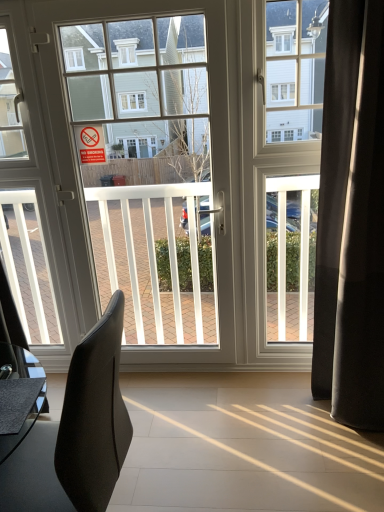
Image resolution: width=384 pixels, height=512 pixels. In order to click on vacant area situated to the left side of black fabric curtain at right in this screenshot , I will do `click(286, 416)`.